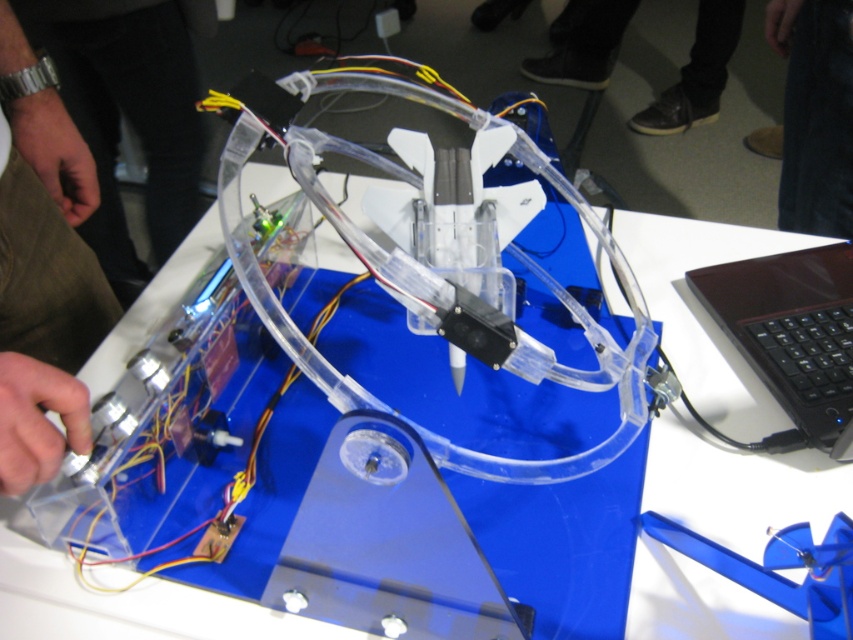
Is metal watch at left further to camera compared to metallic wristwatch at left?

That is False.

The image size is (853, 640). Find the location of `metal watch at left`. metal watch at left is located at coordinates (44, 273).

Which is behind, point (13, 278) or point (155, 144)?

Point (155, 144)

Locate an element on the screen. The image size is (853, 640). metal watch at left is located at coordinates (44, 273).

Image resolution: width=853 pixels, height=640 pixels. Describe the element at coordinates (703, 310) in the screenshot. I see `transparent plastic table at center` at that location.

Is transparent plastic table at center above metal watch at left?

No.

Does point (645, 593) come in front of point (16, 428)?

No, (645, 593) is behind (16, 428).

This screenshot has height=640, width=853. What are the coordinates of `transparent plastic table at center` in the screenshot? It's located at (703, 310).

Identify the location of metal watch at left. (44, 273).

Is metal watch at left behind black leather shoes at lower center?

No, it is not.

Who is more distant from viewer, (32, 404) or (599, 52)?

The point (599, 52) is more distant.

Where is `metal watch at left`? Image resolution: width=853 pixels, height=640 pixels. metal watch at left is located at coordinates (44, 273).